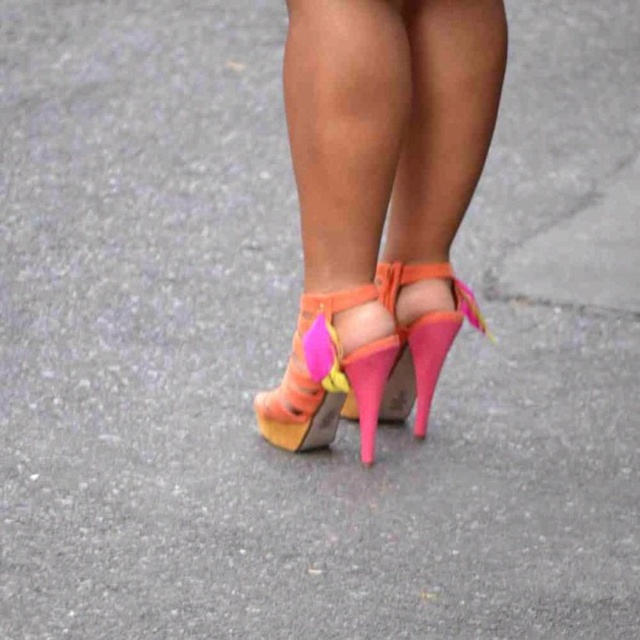
Consider the image. Is pink suede sandal at center bigger than neon pink leather high-heeled sandal at center?

Correct, pink suede sandal at center is larger in size than neon pink leather high-heeled sandal at center.

Measure the distance between point (362, 301) and camera.

Point (362, 301) is 5.73 feet away from camera.

Find the location of `pink suede sandal at center`. pink suede sandal at center is located at coordinates (326, 378).

At what (x,y) coordinates should I click in order to perform the action: click on pink suede sandal at center. Please return your answer as a coordinate pair (x, y). The height and width of the screenshot is (640, 640). Looking at the image, I should click on (326, 378).

Locate an element on the screen. The width and height of the screenshot is (640, 640). neon pink leather high heels at center is located at coordinates (380, 202).

Can you confirm if neon pink leather high heels at center is positioned to the left of pink suede sandal at center?

In fact, neon pink leather high heels at center is to the right of pink suede sandal at center.

Who is more distant from viewer, (x=396, y=212) or (x=387, y=362)?

Point (x=396, y=212)

What are the coordinates of `neon pink leather high heels at center` in the screenshot? It's located at tap(380, 202).

Can you confirm if neon pink leather high heels at center is thinner than neon pink leather high-heeled sandal at center?

In fact, neon pink leather high heels at center might be wider than neon pink leather high-heeled sandal at center.

Can you confirm if neon pink leather high heels at center is wider than neon pink leather high-heeled sandal at center?

Yes.

Who is more distant from viewer, (x=412, y=252) or (x=403, y=364)?

The point (x=403, y=364) is behind.

Find the location of a particular element. This screenshot has width=640, height=640. neon pink leather high heels at center is located at coordinates (380, 202).